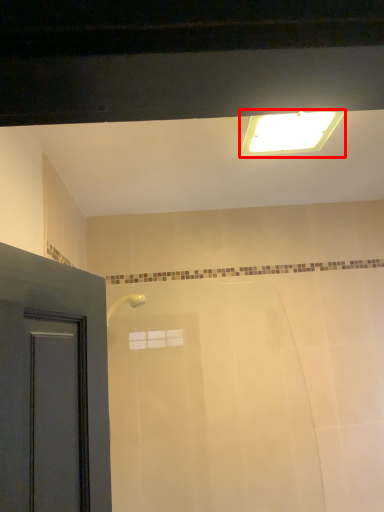
Question: Where is lighting (annotated by the red box) located in relation to bath in the image?

Choices:
 (A) left
 (B) right

Answer: (B)